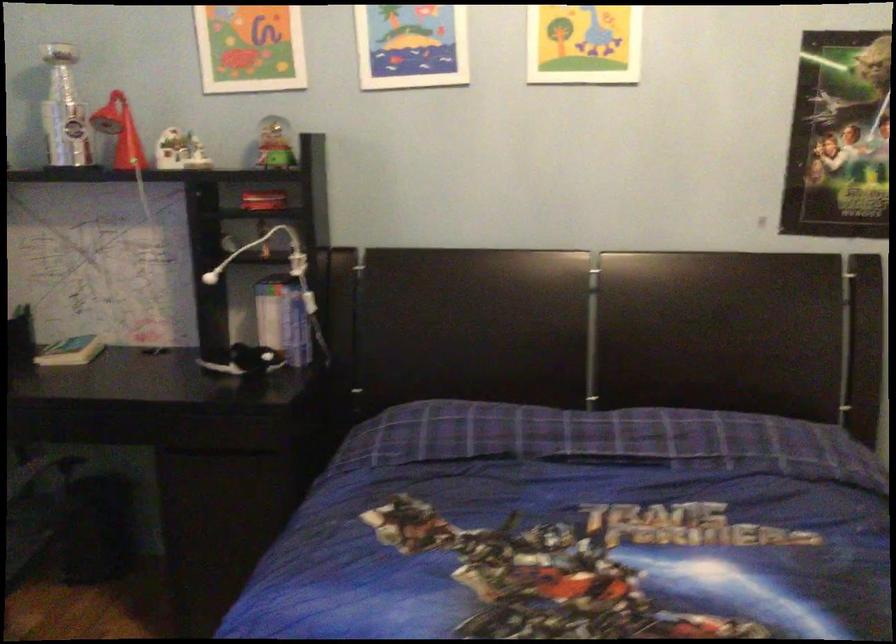
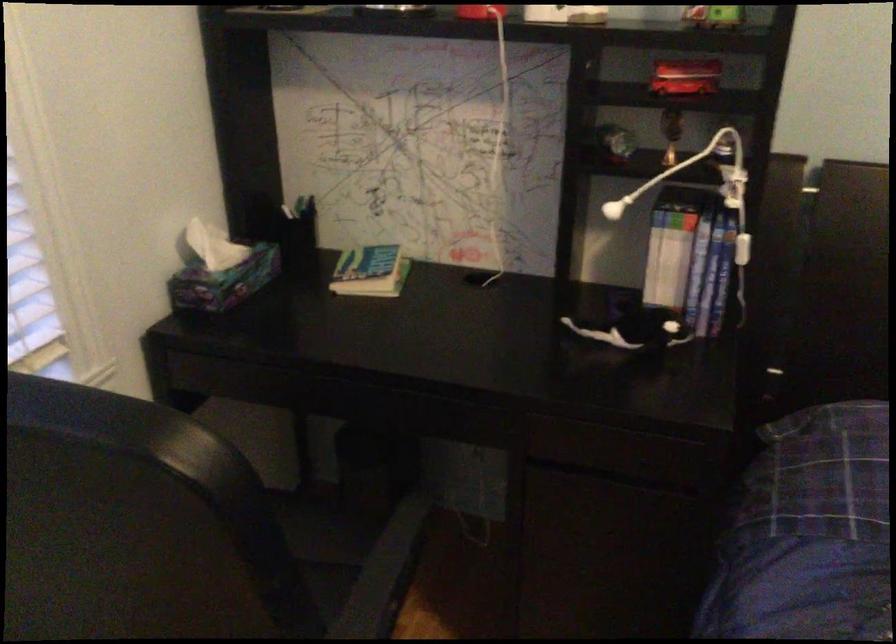
Where in the second image is the point corresponding to point 264,194 from the first image?

(685, 77)